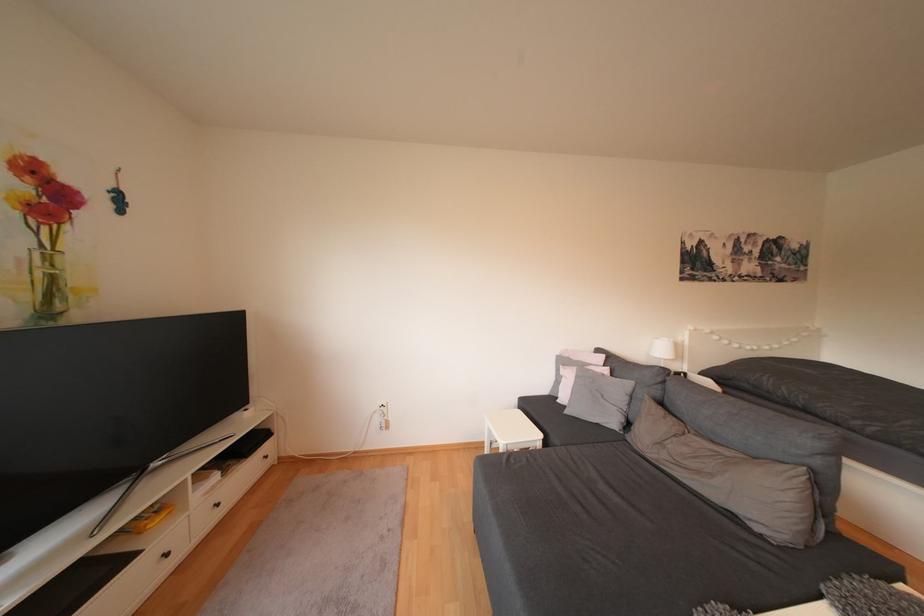
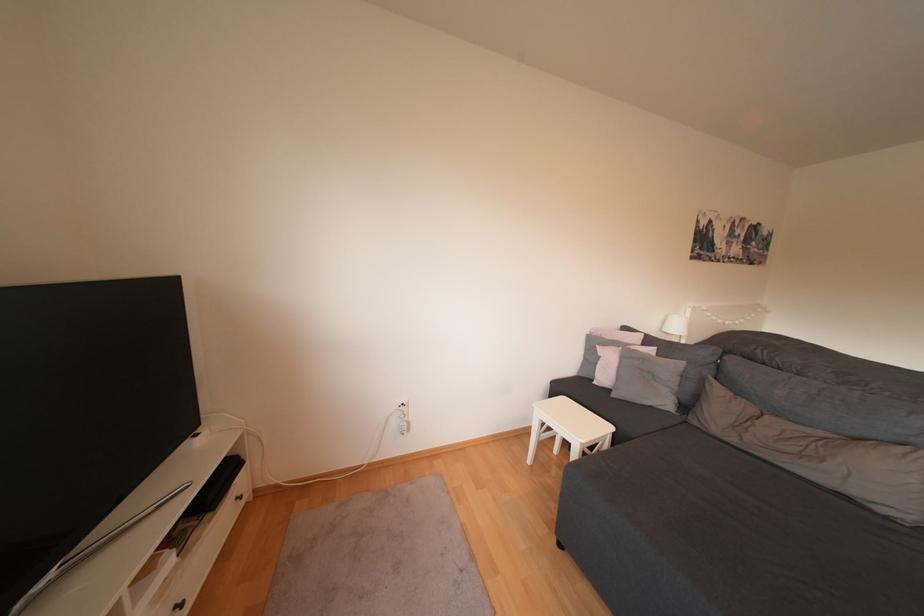
Question: The first image is from the beginning of the video and the second image is from the end. How did the camera likely rotate when shooting the video?

Choices:
 (A) Left
 (B) Right
 (C) Up
 (D) Down

Answer: (B)